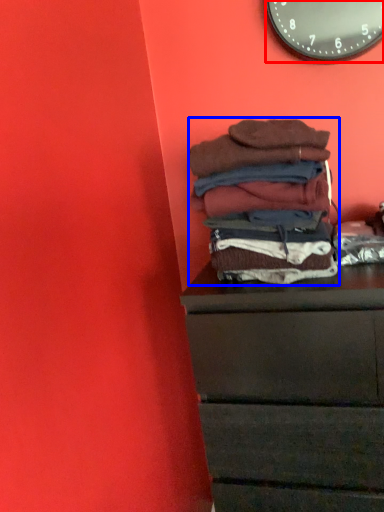
Question: Among these objects, which one is farthest to the camera, wall clock (highlighted by a red box) or material (highlighted by a blue box)?

Choices:
 (A) wall clock
 (B) material

Answer: (A)